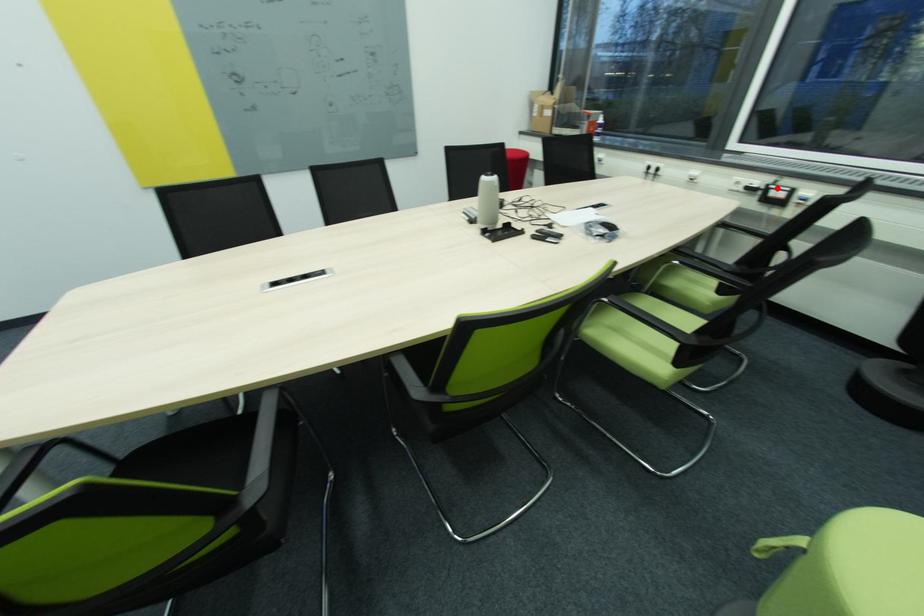
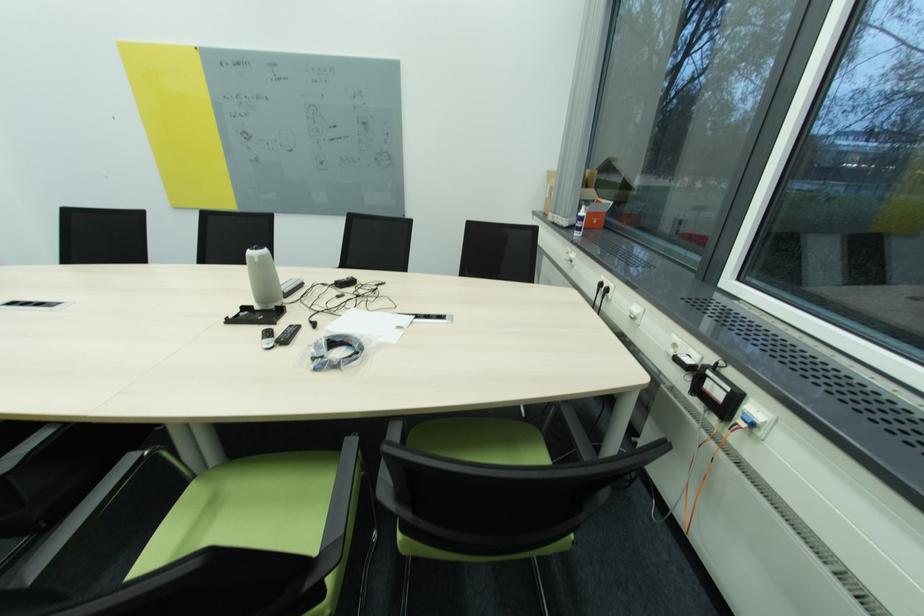
Locate, in the second image, the point that corresponds to the highlighted location in the first image.

(713, 373)